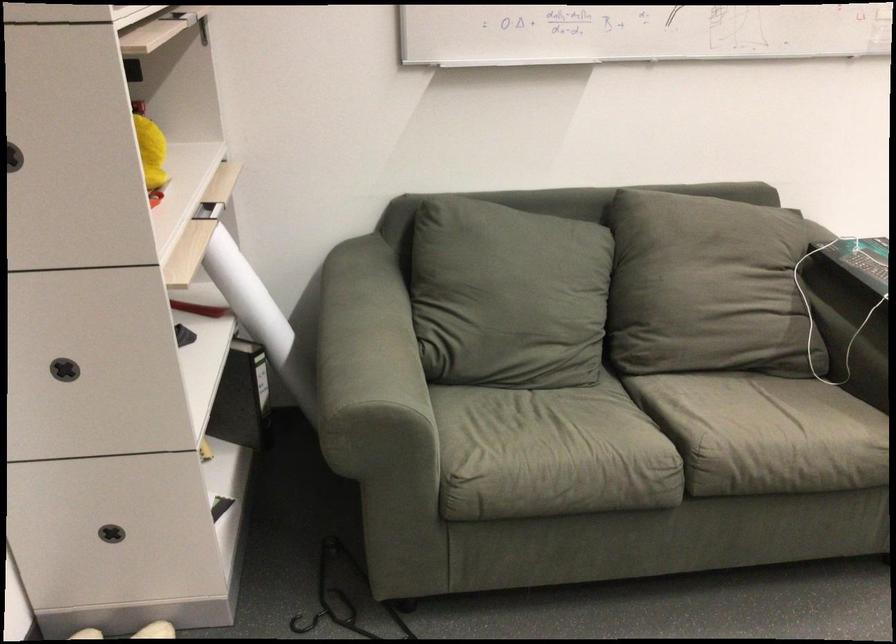
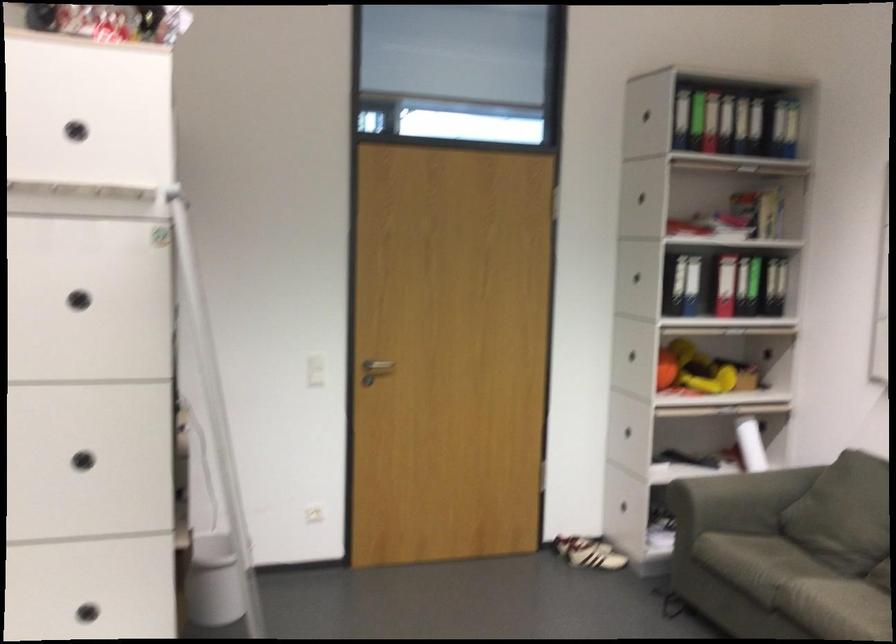
Find the pixel in the second image that matches point (649, 504) in the first image.

(771, 623)